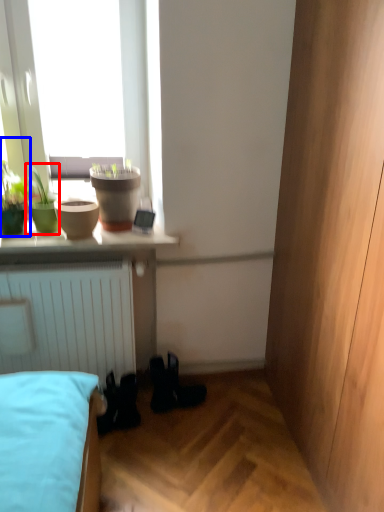
Question: Which point is closer to the camera, houseplant (highlighted by a red box) or houseplant (highlighted by a blue box)?

Choices:
 (A) houseplant
 (B) houseplant

Answer: (B)